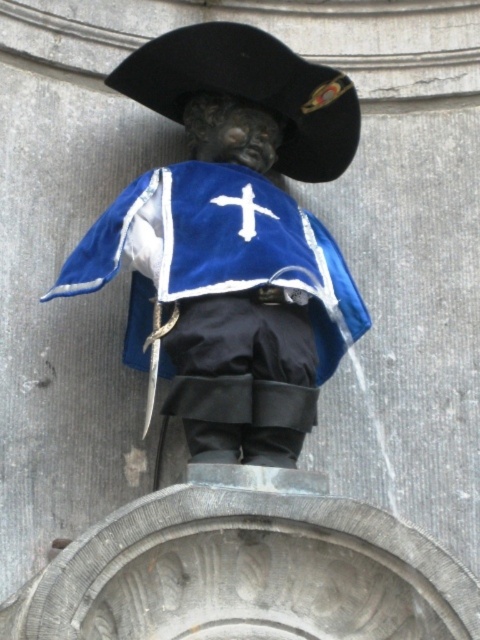
Question: Does velvet blue cape at center have a larger size compared to black felt hat at upper center?

Choices:
 (A) yes
 (B) no

Answer: (A)

Question: Which point is farther from the camera taking this photo?

Choices:
 (A) (269, 458)
 (B) (288, 81)

Answer: (B)

Question: Does velvet blue cape at center appear over black felt hat at upper center?

Choices:
 (A) no
 (B) yes

Answer: (A)

Question: Which of the following is the farthest from the observer?

Choices:
 (A) velvet blue cape at center
 (B) black felt hat at upper center

Answer: (B)

Question: Does velvet blue cape at center lie behind black felt hat at upper center?

Choices:
 (A) no
 (B) yes

Answer: (A)